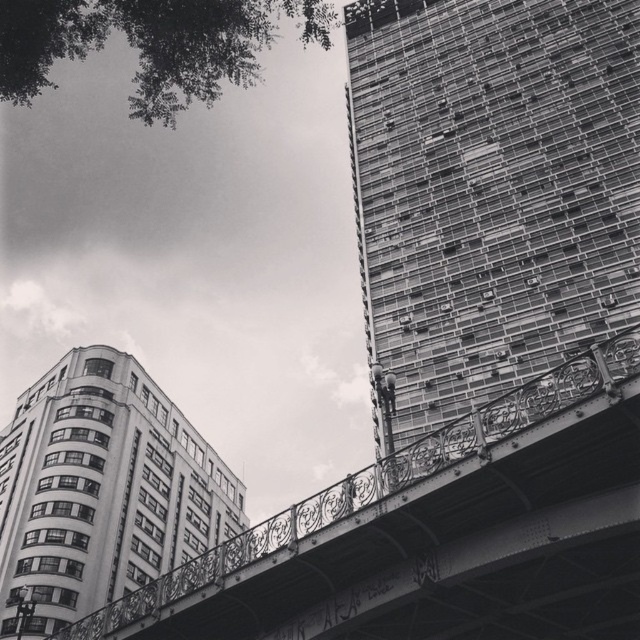
Is metallic glass building at upper right above metallic bridge at center?

Indeed, metallic glass building at upper right is positioned over metallic bridge at center.

Does point (529, 196) come farther from viewer compared to point (420, 468)?

Yes.

Image resolution: width=640 pixels, height=640 pixels. Find the location of `metallic glass building at upper right`. metallic glass building at upper right is located at coordinates (492, 189).

Is metallic glass building at upper right below white glass building at lower left?

Incorrect, metallic glass building at upper right is not positioned below white glass building at lower left.

Can you confirm if metallic glass building at upper right is shorter than white glass building at lower left?

Incorrect, metallic glass building at upper right's height does not fall short of white glass building at lower left's.

Find the location of `metallic glass building at upper right`. metallic glass building at upper right is located at coordinates (492, 189).

Between white glass building at lower left and metallic bridge at center, which one is positioned lower?

Positioned lower is metallic bridge at center.

Is white glass building at lower left thinner than metallic bridge at center?

Yes.

Between point (150, 378) and point (417, 468), which one is positioned in front?

Point (417, 468)

Find the location of a particular element. The height and width of the screenshot is (640, 640). white glass building at lower left is located at coordinates (102, 490).